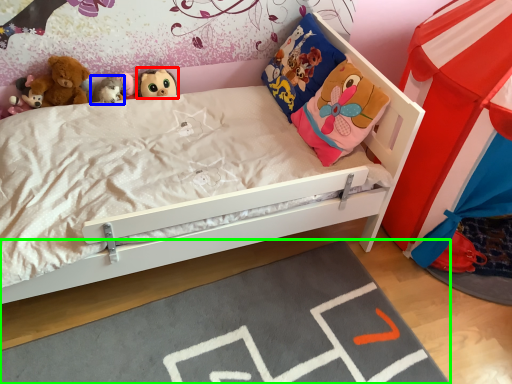
Question: Based on their relative distances, which object is farther from toy (highlighted by a red box)? Choose from toy (highlighted by a blue box) and plain (highlighted by a green box).

Choices:
 (A) toy
 (B) plain

Answer: (B)